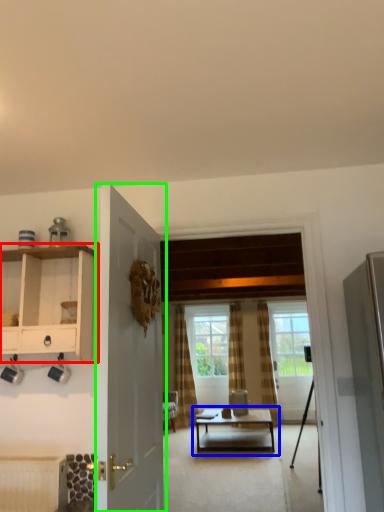
Question: Which object is the farthest from cabinetry (highlighted by a red box)? Choose among these: coffee table (highlighted by a blue box) or door (highlighted by a green box).

Choices:
 (A) coffee table
 (B) door

Answer: (A)